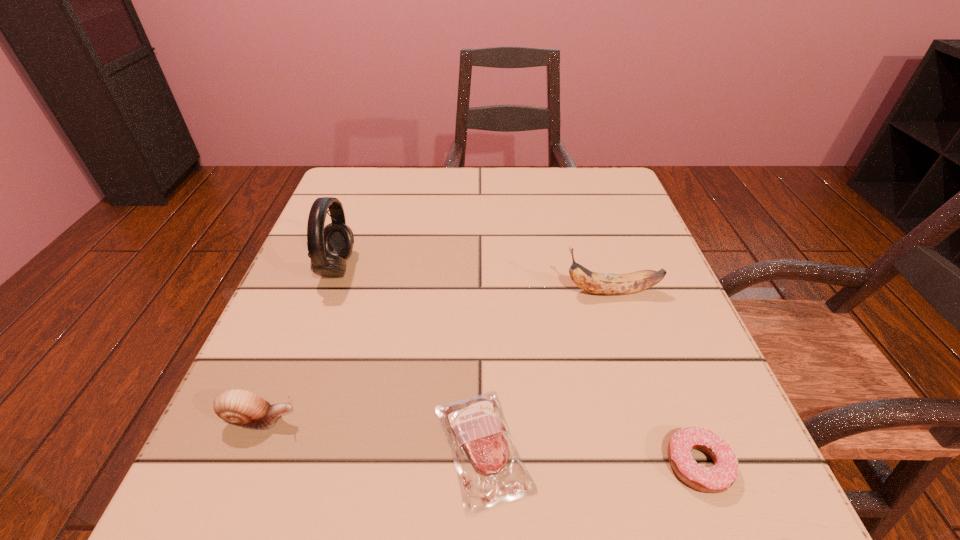
Locate an element on the screen. The width and height of the screenshot is (960, 540). vacant area situated on the front-facing side of the third tallest object is located at coordinates (525, 420).

This screenshot has height=540, width=960. I want to click on vacant region located 0.330m on the left of the doughnut, so click(x=412, y=464).

Locate an element on the screen. Image resolution: width=960 pixels, height=540 pixels. vacant position located 0.330m on the back of the third object from left to right is located at coordinates (482, 252).

Where is `doughnut present at the near edge`? The width and height of the screenshot is (960, 540). doughnut present at the near edge is located at coordinates (719, 478).

What are the coordinates of `steak that is at the near edge` in the screenshot? It's located at (486, 458).

Where is `headset located in the left edge section of the desktop`? This screenshot has width=960, height=540. headset located in the left edge section of the desktop is located at coordinates (328, 247).

The width and height of the screenshot is (960, 540). What are the coordinates of `escargot at the left edge` in the screenshot? It's located at tap(239, 407).

I want to click on banana at the right edge, so click(599, 283).

Where is `doughnut present at the right edge`? The height and width of the screenshot is (540, 960). doughnut present at the right edge is located at coordinates (719, 478).

Where is `object located in the near right corner section of the desktop`? Image resolution: width=960 pixels, height=540 pixels. object located in the near right corner section of the desktop is located at coordinates (719, 478).